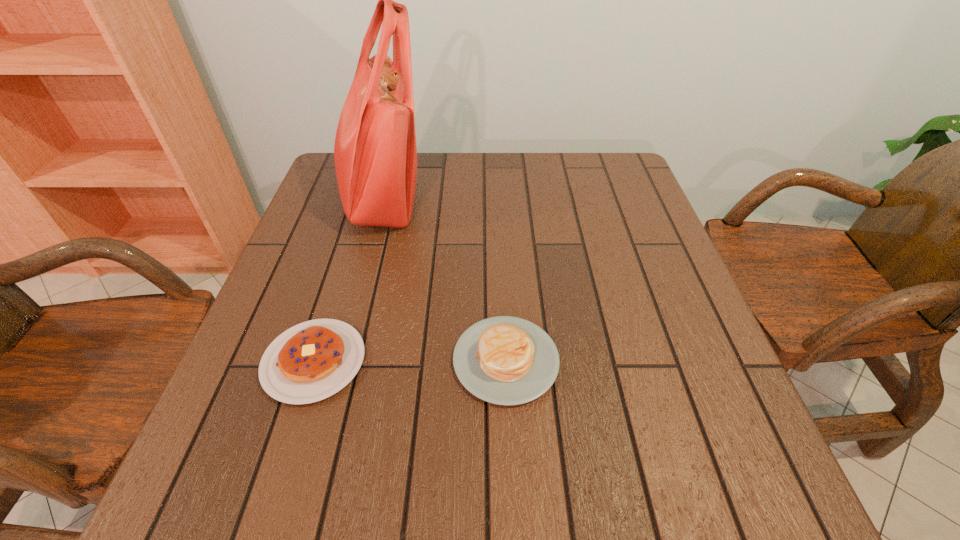
At what (x,y) coordinates should I click in order to perform the action: click on handbag that is at the left edge. Please return your answer as a coordinate pair (x, y). This screenshot has width=960, height=540. Looking at the image, I should click on (375, 152).

Locate an element on the screen. This screenshot has width=960, height=540. pancake that is at the left edge is located at coordinates (313, 360).

In order to click on object present at the far left corner in this screenshot , I will do `click(375, 152)`.

At what (x,y) coordinates should I click in order to perform the action: click on vacant area at the far edge of the desktop. Please return your answer as a coordinate pair (x, y). This screenshot has width=960, height=540. Looking at the image, I should click on (553, 160).

Locate an element on the screen. The height and width of the screenshot is (540, 960). vacant space at the left edge of the desktop is located at coordinates (277, 403).

Where is `free spot at the right edge of the desktop`? This screenshot has height=540, width=960. free spot at the right edge of the desktop is located at coordinates (627, 212).

At what (x,y) coordinates should I click in order to perform the action: click on free point at the far right corner. Please return your answer as a coordinate pair (x, y). The image size is (960, 540). Looking at the image, I should click on (627, 178).

What are the coordinates of `free area in between the right pancake and the shorter pancake` in the screenshot? It's located at (410, 361).

What are the coordinates of `free spot between the handbag and the rightmost object` in the screenshot? It's located at (444, 279).

Where is `vacant area between the second shortest object and the shortest object`? The image size is (960, 540). vacant area between the second shortest object and the shortest object is located at coordinates (410, 361).